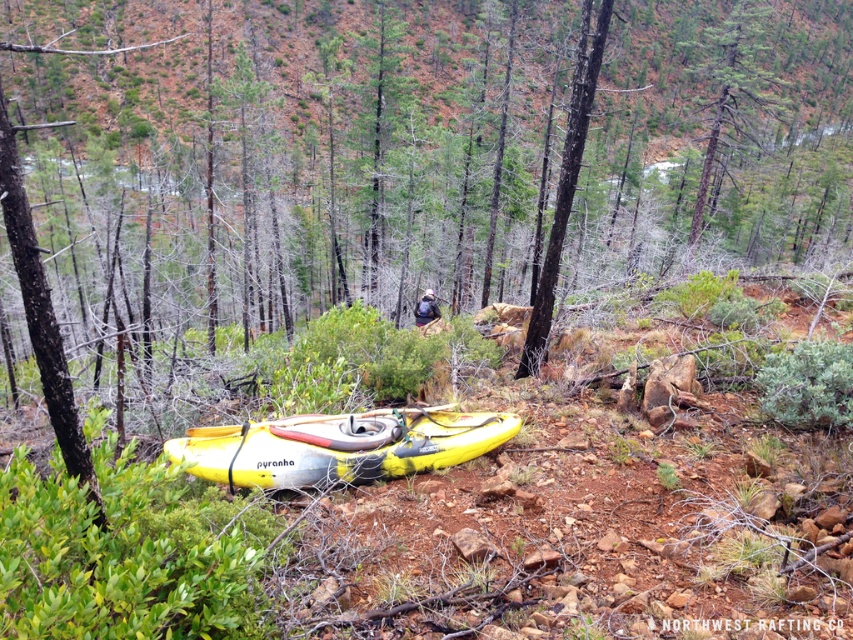
Question: Can you confirm if smooth brown tree trunk at upper center is thinner than smooth bark tree at center?

Choices:
 (A) no
 (B) yes

Answer: (A)

Question: Which point appears closest to the camera in this image?

Choices:
 (A) (575, 172)
 (B) (759, 22)

Answer: (A)

Question: Can you confirm if yellow matte kayak at center is bigger than smooth brown tree trunk at upper center?

Choices:
 (A) yes
 (B) no

Answer: (B)

Question: Which of the following is the farthest from the observer?

Choices:
 (A) (582, 99)
 (B) (756, 81)

Answer: (B)

Question: Based on their relative distances, which object is farther from the smooth brown tree trunk at upper center?

Choices:
 (A) yellow matte kayak at center
 (B) smooth bark tree at center

Answer: (B)

Question: Can you confirm if yellow matte kayak at center is positioned below smooth bark tree at center?

Choices:
 (A) no
 (B) yes

Answer: (B)